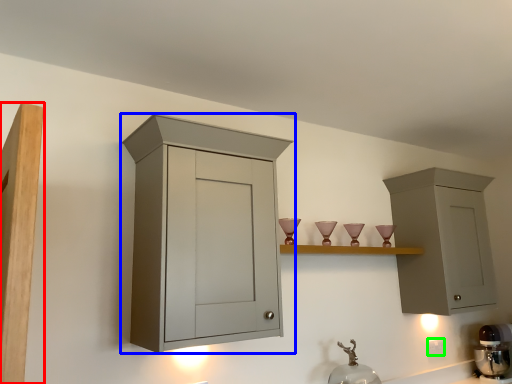
Question: Estimate the real-world distances between objects in this image. Which object is closer to cupboard (highlighted by a red box), cabinetry (highlighted by a blue box) or electric outlet (highlighted by a green box)?

Choices:
 (A) cabinetry
 (B) electric outlet

Answer: (A)